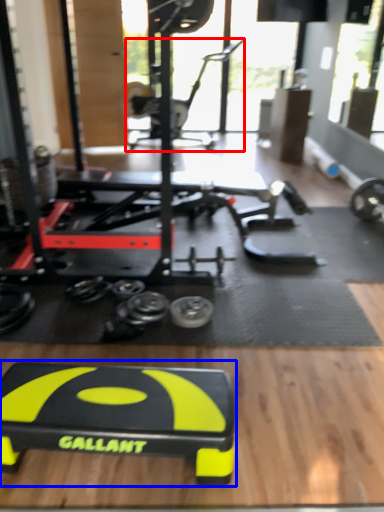
Question: Which of the following is the closest to the observer, sport equipment (highlighted by a red box) or sport equipment (highlighted by a blue box)?

Choices:
 (A) sport equipment
 (B) sport equipment

Answer: (B)